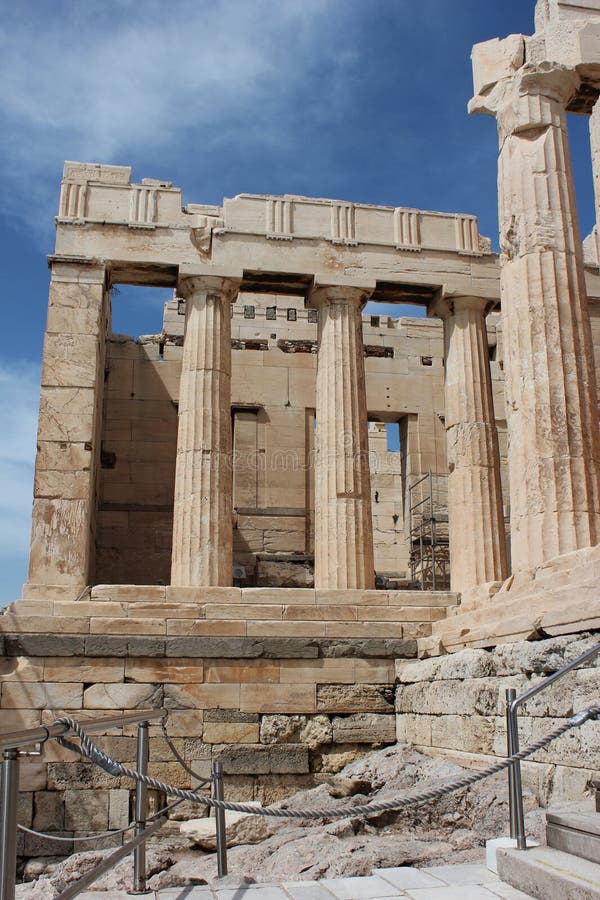
At what (x,y) coordinates should I click in order to perform the action: click on column. Please return your answer as a coordinate pair (x, y). Looking at the image, I should click on (333, 567), (206, 570).